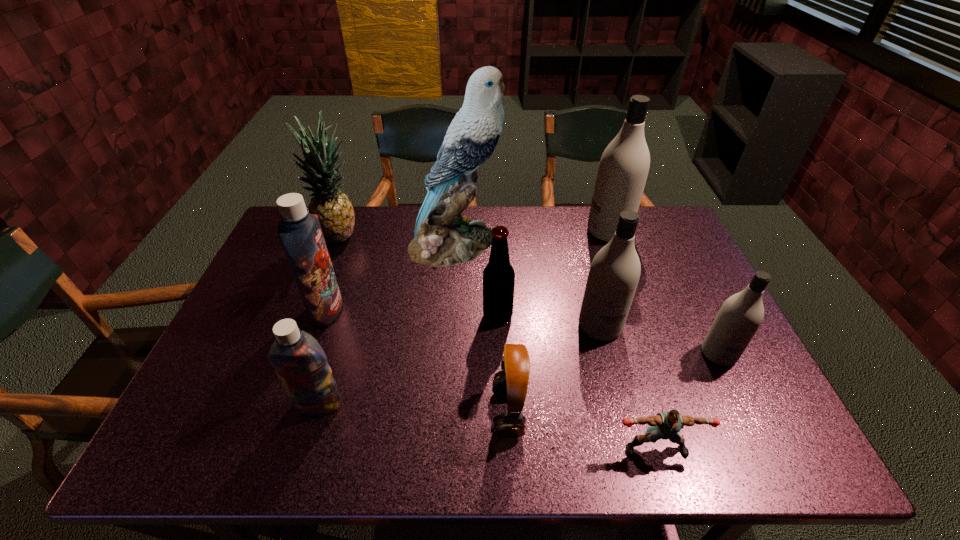
Point out which shampoo is positioned as the second nearest to the nearer blue shampoo. Please provide its 2D coordinates. Your answer should be formatted as a tuple, i.e. [(x, y)], where the tuple contains the x and y coordinates of a point satisfying the conditions above.

[(614, 273)]

The image size is (960, 540). Find the location of `white shampoo that is the third closest to the beer bottle`. white shampoo that is the third closest to the beer bottle is located at coordinates (740, 316).

Identify which white shampoo is the second closest to the rightmost object. Please provide its 2D coordinates. Your answer should be formatted as a tuple, i.e. [(x, y)], where the tuple contains the x and y coordinates of a point satisfying the conditions above.

[(624, 165)]

At what (x,y) coordinates should I click in order to perform the action: click on free point that satisfies the following two spatial constraints: 1. on the front label of the beer bottle; 2. on the left side of the bigger blue shampoo. Please return your answer as a coordinate pair (x, y). The image size is (960, 540). Looking at the image, I should click on (324, 316).

The width and height of the screenshot is (960, 540). In order to click on vacant space that satisfies the following two spatial constraints: 1. on the front label of the farther blue shampoo; 2. on the right side of the beer bottle in this screenshot , I will do `click(324, 316)`.